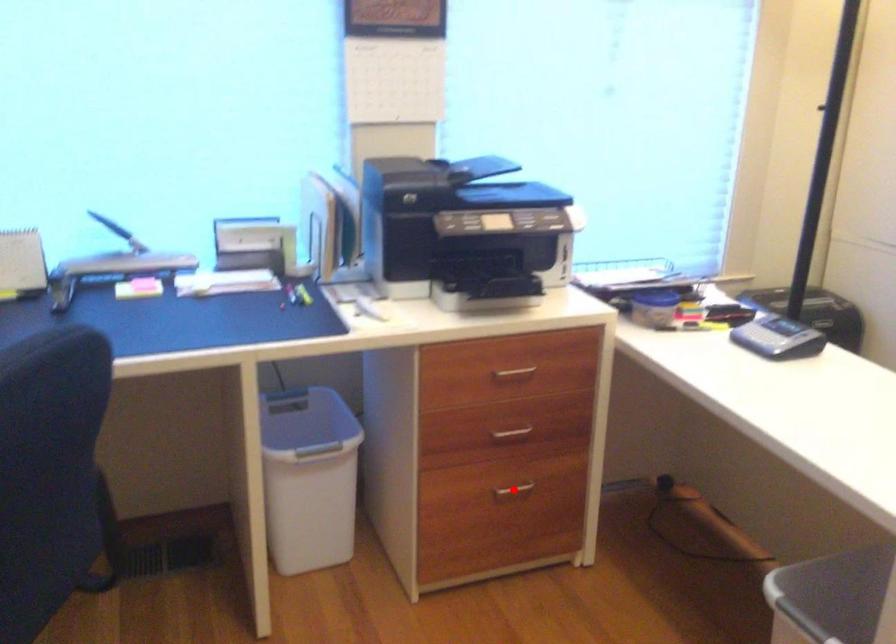
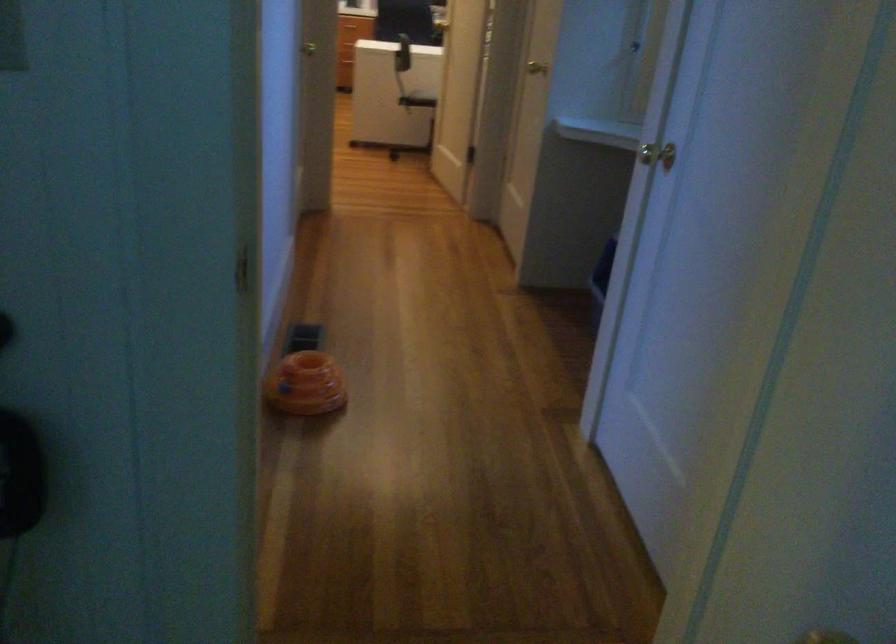
Question: I am providing you with two images of the same scene from different viewpoints. A red point is marked on the first image. Can you still see the location of the red point in image 2?

Choices:
 (A) Yes
 (B) No

Answer: (B)